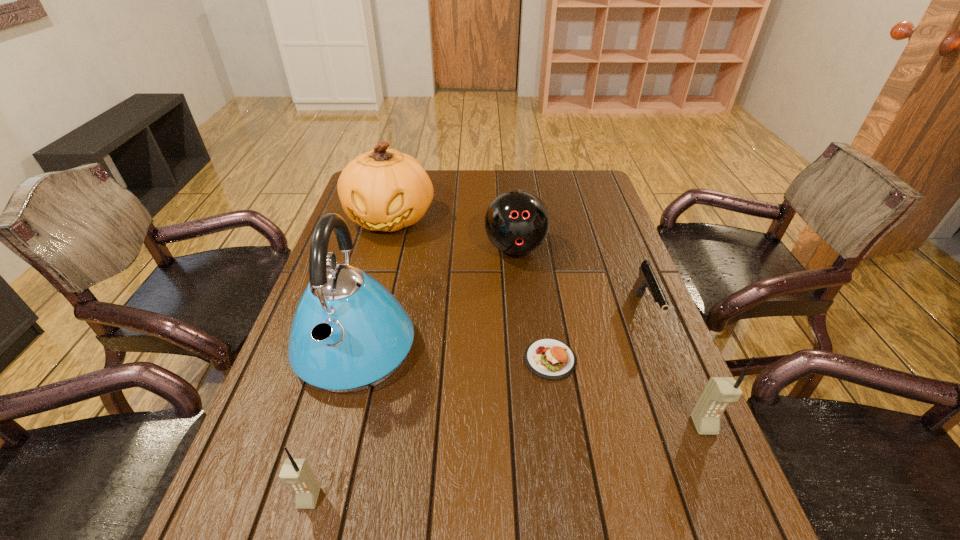
Find the location of a particular element. cellular telephone that is at the right edge is located at coordinates (720, 391).

Where is `pistol that is positioned at the right edge`? The height and width of the screenshot is (540, 960). pistol that is positioned at the right edge is located at coordinates (647, 280).

This screenshot has width=960, height=540. I want to click on object at the far left corner, so click(381, 190).

Where is `object that is at the near left corner`? object that is at the near left corner is located at coordinates (297, 472).

This screenshot has height=540, width=960. Find the location of `vacant point at the far edge`. vacant point at the far edge is located at coordinates (503, 170).

In the image, there is a desktop. Where is `free region at the near edge`? The image size is (960, 540). free region at the near edge is located at coordinates (445, 480).

At what (x,y) coordinates should I click in order to perform the action: click on free space at the right edge of the desktop. Please return your answer as a coordinate pair (x, y). This screenshot has height=540, width=960. Looking at the image, I should click on (613, 231).

Where is `vacant space at the far right corner of the desktop`? vacant space at the far right corner of the desktop is located at coordinates (560, 175).

This screenshot has width=960, height=540. I want to click on vacant point located between the pumpkin and the sixth farthest object, so click(x=547, y=322).

Where is `free space between the patty (food) and the bowling ball`? This screenshot has width=960, height=540. free space between the patty (food) and the bowling ball is located at coordinates click(x=533, y=304).